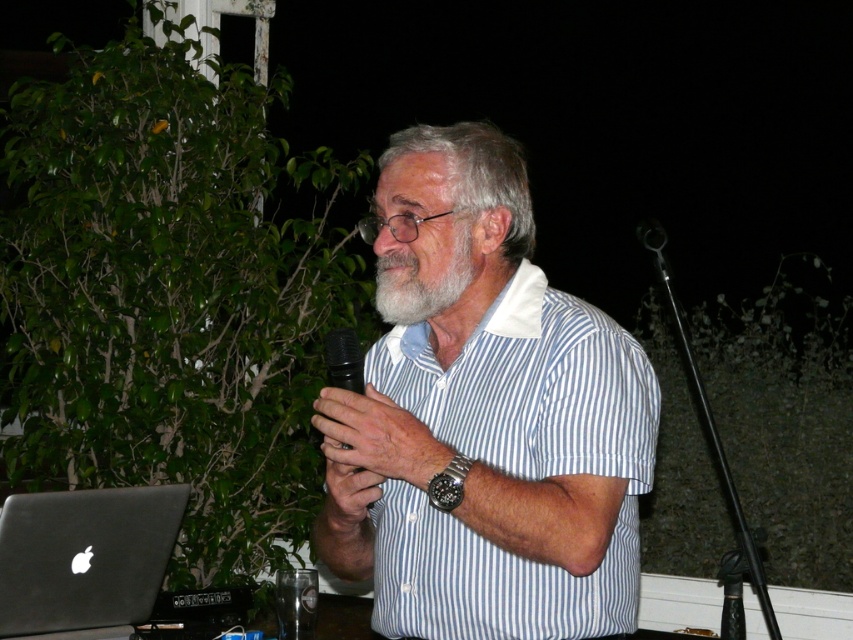
Question: Which point is closer to the camera taking this photo?

Choices:
 (A) (9, 602)
 (B) (628, 474)
 (C) (387, 257)
 (D) (360, 356)

Answer: (B)

Question: Can you confirm if sleek silver laptop at lower left is bigger than grayhairbeard at center?

Choices:
 (A) no
 (B) yes

Answer: (B)

Question: Among these points, which one is nearest to the camera?

Choices:
 (A) (105, 625)
 (B) (399, 253)
 (C) (335, 420)

Answer: (B)

Question: Is sleek silver laptop at lower left closer to the viewer compared to grayhairbeard at center?

Choices:
 (A) no
 (B) yes

Answer: (A)

Question: Can you confirm if white striped shirt at center is smaller than black plastic microphone at center?

Choices:
 (A) yes
 (B) no

Answer: (B)

Question: Among these objects, which one is nearest to the camera?

Choices:
 (A) matte black microphone at center
 (B) black plastic microphone at center
 (C) grayhairbeard at center

Answer: (A)